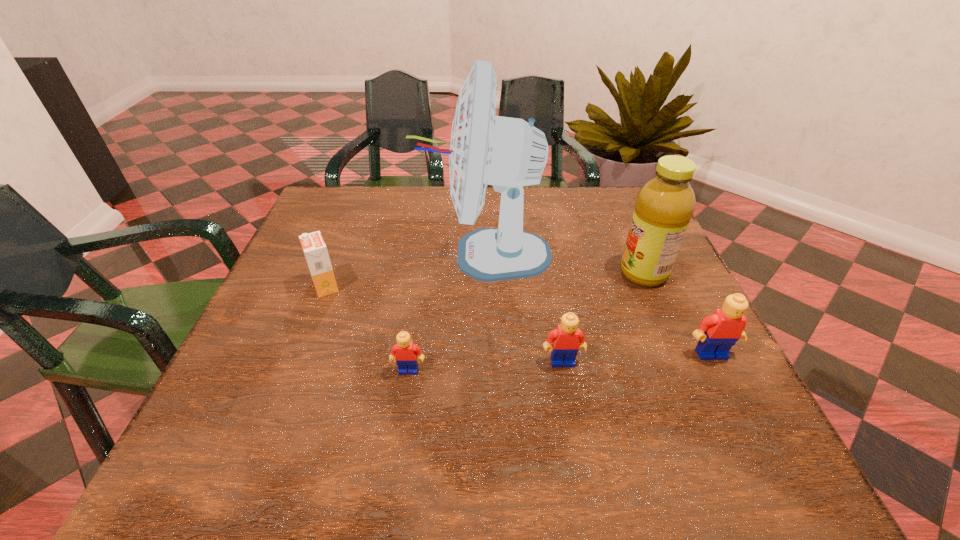
Please point a spot to add another Lego on the left. Please provide its 2D coordinates. Your answer should be formatted as a tuple, i.e. [(x, y)], where the tuple contains the x and y coordinates of a point satisfying the conditions above.

[(249, 379)]